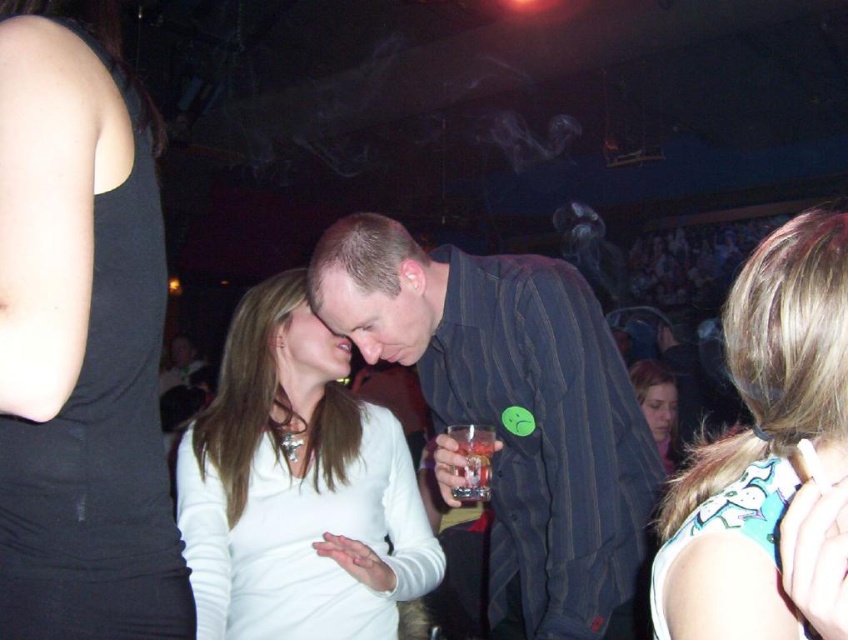
Question: Does black matte tank top at upper left have a lesser width compared to translucent glass at center?

Choices:
 (A) yes
 (B) no

Answer: (B)

Question: Which point is farther from the camera taking this photo?

Choices:
 (A) (665, 436)
 (B) (722, 561)

Answer: (A)

Question: Is white matte shirt at center to the right of matte black hair at lower right from the viewer's perspective?

Choices:
 (A) no
 (B) yes

Answer: (A)

Question: Which object is farther from the camera taking this photo?

Choices:
 (A) matte black hair at lower right
 (B) teal printed tank top at right

Answer: (A)

Question: Which object is closer to the camera taking this photo?

Choices:
 (A) white matte shirt at center
 (B) striped fabric shirt at center
 (C) teal printed tank top at right

Answer: (C)

Question: Does teal printed tank top at right have a lesser width compared to translucent glass at center?

Choices:
 (A) no
 (B) yes

Answer: (A)